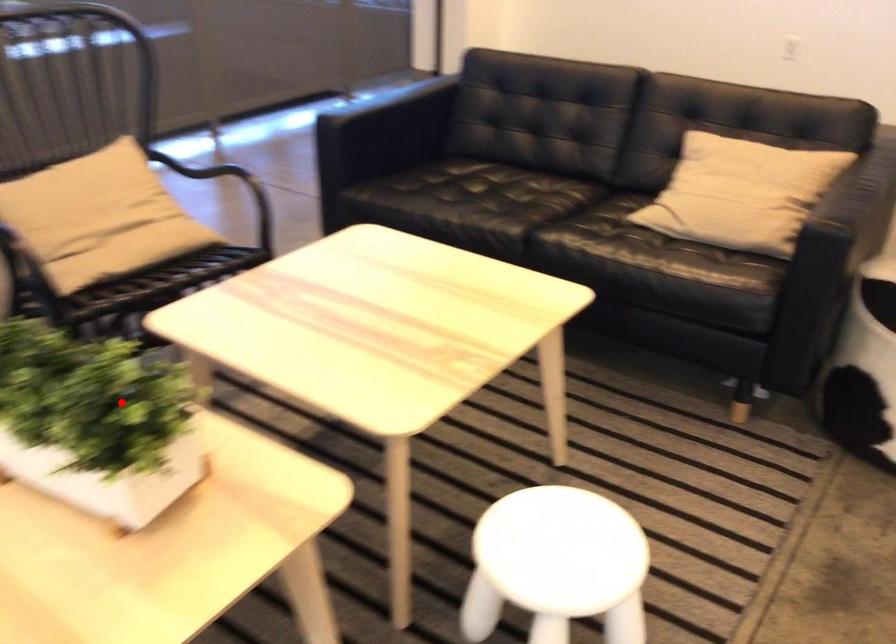
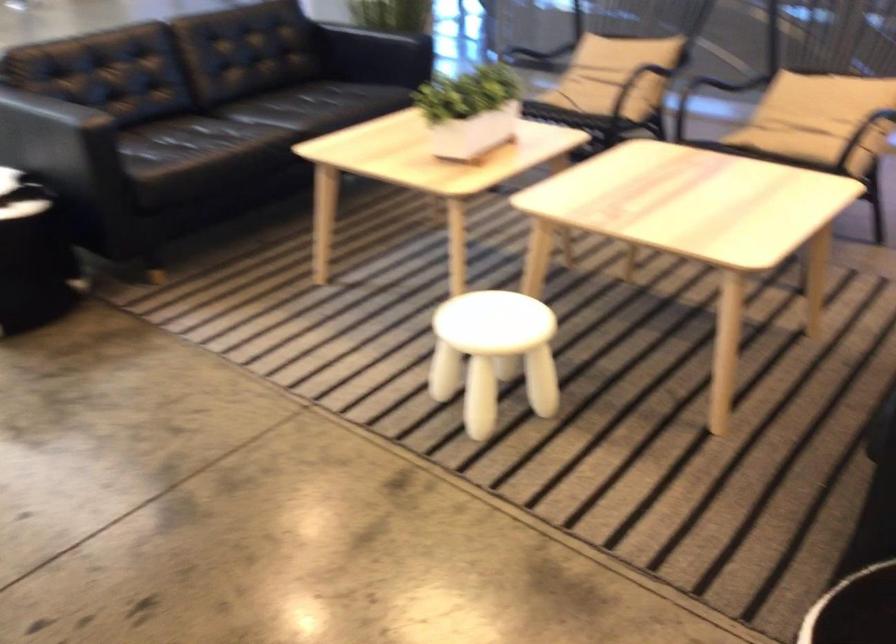
The point at the highlighted location is marked in the first image. Where is the corresponding point in the second image?

(470, 111)